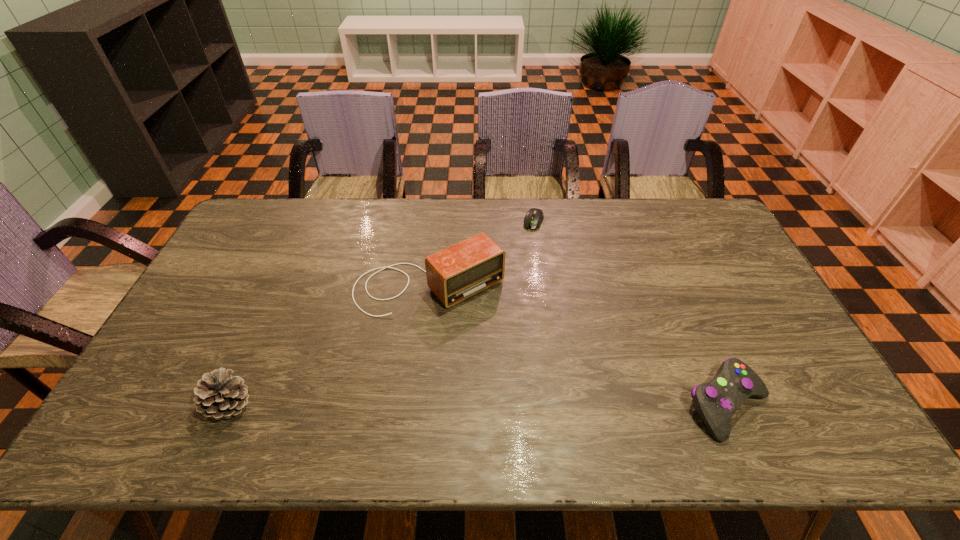
Image resolution: width=960 pixels, height=540 pixels. Find the location of `the leftmost object`. the leftmost object is located at coordinates (220, 395).

I want to click on the second shortest object, so click(x=716, y=401).

Where is `the rightmost object`? the rightmost object is located at coordinates (716, 401).

At what (x,y) coordinates should I click in order to perform the action: click on radio receiver. Please return your answer as a coordinate pair (x, y). The image size is (960, 540). Looking at the image, I should click on (460, 271).

Find the location of a particular element. the third nearest object is located at coordinates (460, 271).

Image resolution: width=960 pixels, height=540 pixels. Identify the location of the farthest object. (534, 217).

I want to click on the second object from right to left, so click(x=534, y=217).

Locate an element on the screen. The image size is (960, 540). vacant region located 0.150m on the back of the leftmost object is located at coordinates (260, 338).

Locate an element on the screen. vacant space located 0.350m on the left of the rightmost object is located at coordinates 540,404.

I want to click on vacant space located on the front-facing side of the radio receiver, so click(x=507, y=352).